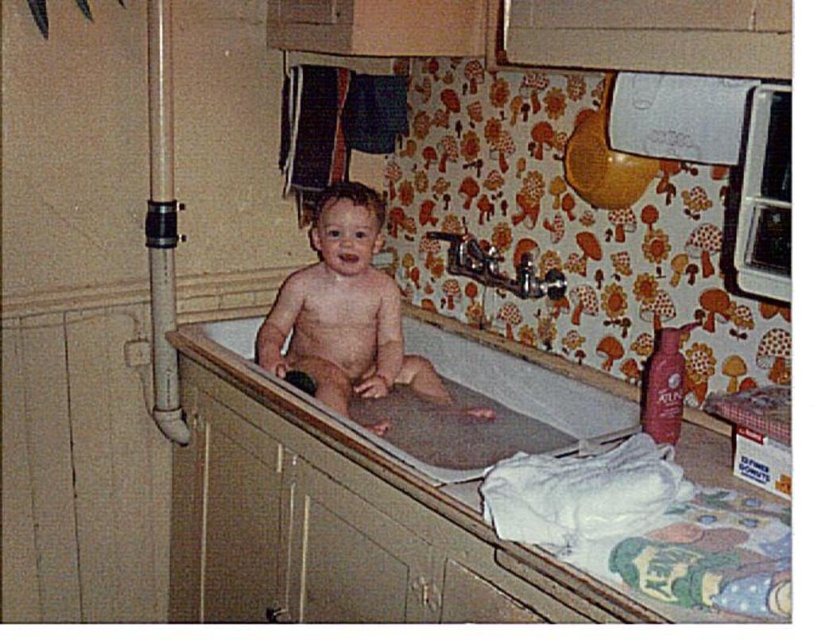
Question: Is smooth skin baby at center bigger than smooth plastic bathtub at center?

Choices:
 (A) yes
 (B) no

Answer: (A)

Question: From the image, what is the correct spatial relationship of smooth skin baby at center in relation to smooth plastic bathtub at center?

Choices:
 (A) above
 (B) below

Answer: (A)

Question: Is smooth skin baby at center positioned in front of smooth plastic bathtub at center?

Choices:
 (A) yes
 (B) no

Answer: (B)